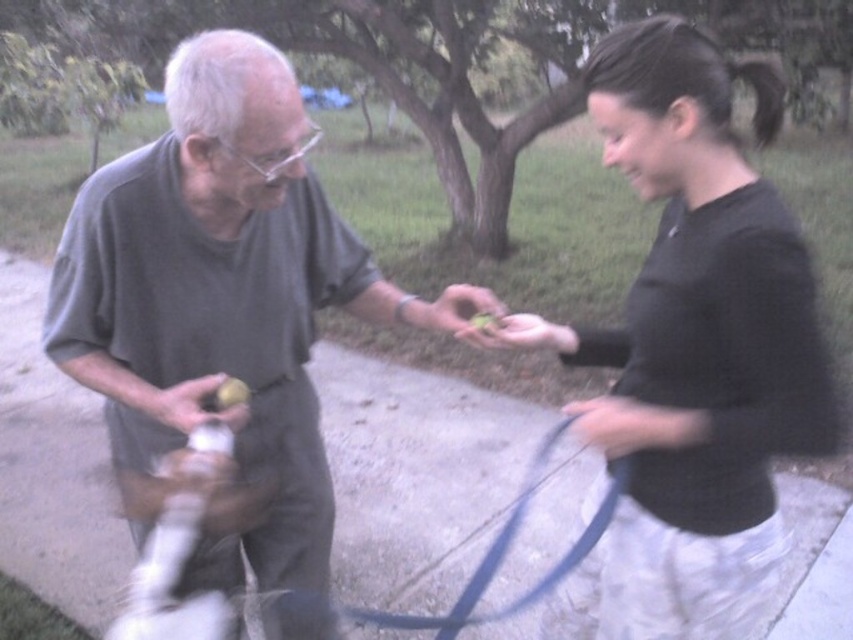
Question: Does white fur dog at lower left have a smaller size compared to blue rubber leash at lower center?

Choices:
 (A) no
 (B) yes

Answer: (B)

Question: Considering the real-world distances, which object is closest to the yellow matte apple at center?

Choices:
 (A) white fur dog at lower left
 (B) white matte food at center
 (C) smooth black glove at lower center

Answer: (A)

Question: Which point is farther to the camera?

Choices:
 (A) matte white spray can at center
 (B) smooth green apple at center
 (C) yellow matte apple at center
 (D) white matte food at center

Answer: (B)

Question: Does white fur dog at lower left appear on the right side of yellow matte apple at center?

Choices:
 (A) no
 (B) yes

Answer: (A)

Question: Is white fur dog at lower left positioned before blue rubber leash at lower center?

Choices:
 (A) no
 (B) yes

Answer: (A)

Question: Which of the following is the farthest from the observer?

Choices:
 (A) smooth green apple at center
 (B) matte gray shirt at center
 (C) smooth black glove at lower center
 (D) blue rubber leash at lower center

Answer: (A)